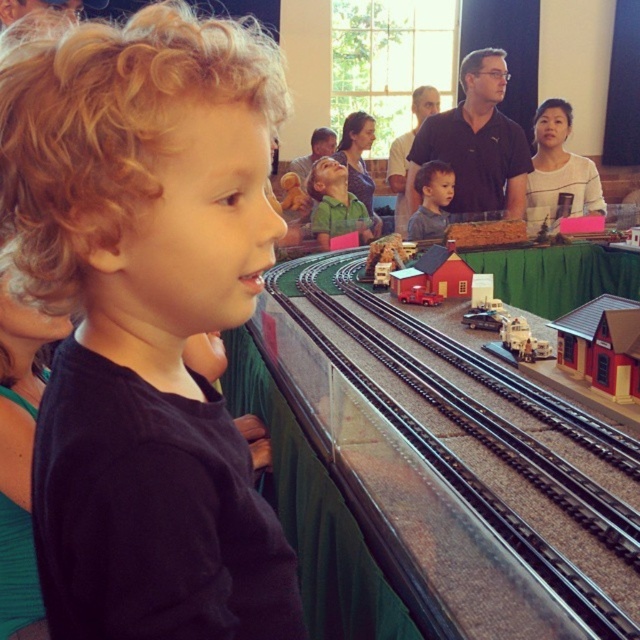
You are a photographer standing at the camera position. You want to take a photo of the point at coordinates point (154,328). The focus range of your camera is set to 50 centimeters. Will the point be in focus?

The point point (154,328) is 52.97 centimeters from the camera, which is slightly beyond the focus range of 50 centimeters. Therefore, the point may not be in focus.

You are a photographer trying to capture the child in the scene. Since the dark blue shirt at center and smooth brown hair at center are both visible in your viewfinder, which one do you need to adjust your focus on to ensure the child is centered properly?

The dark blue shirt at center is wider than the smooth brown hair at center, so you should focus on the dark blue shirt at center to center the child properly.